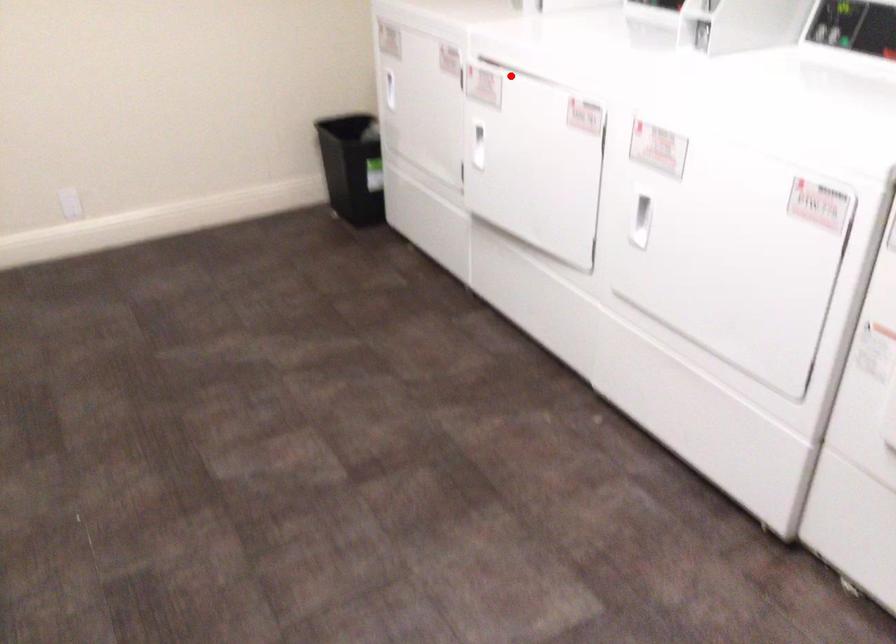
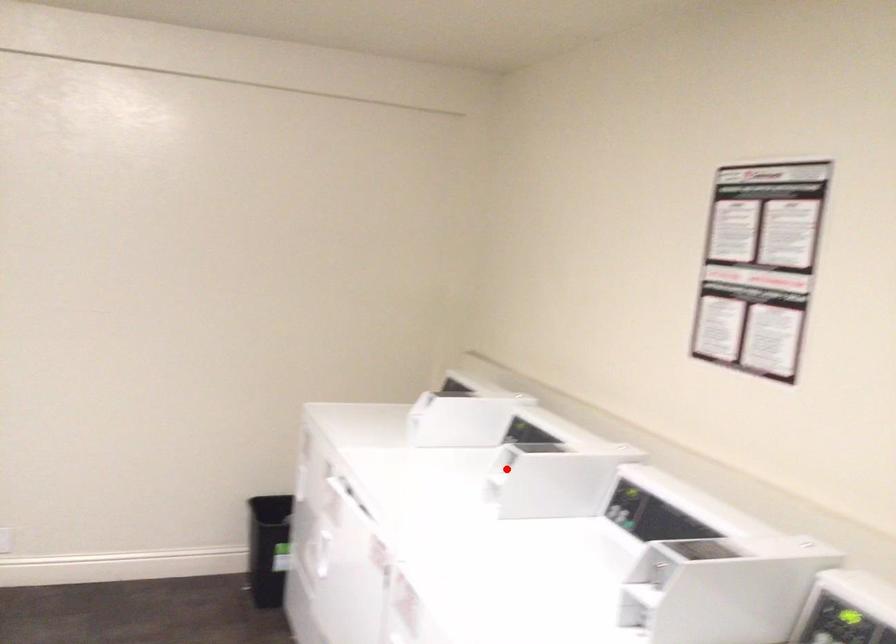
I am providing you with two images of the same scene from different viewpoints. A red point is marked on the first image and another point is marked on the second image. Are the points marked in image1 and image2 representing the same 3D position?

No